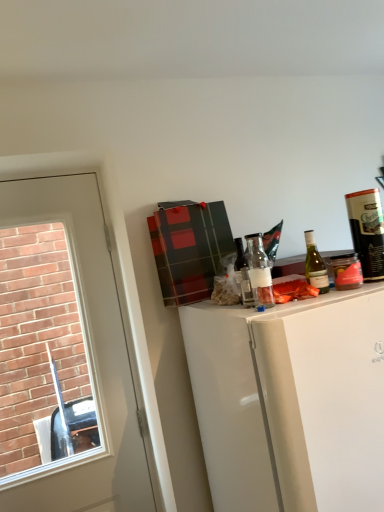
Image resolution: width=384 pixels, height=512 pixels. Describe the element at coordinates (367, 231) in the screenshot. I see `matte black canister at upper right, acting as the first bottle starting from the right` at that location.

You are a GUI agent. You are given a task and a screenshot of the screen. Output one action in this format:
    pyautogui.click(x=<x>, y=<y>)
    Task: Click on the green glass bottle at upper right
    Image resolution: width=384 pixels, height=512 pixels.
    Given the screenshot: What is the action you would take?
    coord(346,271)

Locate an element on the screen. green glass bottle at upper right, the second bottle when ordered from left to right is located at coordinates (315, 265).

What is the approximate width of green glass bottle at upper right, the second bottle when ordered from left to right?

green glass bottle at upper right, the second bottle when ordered from left to right, is 2.02 inches in width.

Locate an element on the screen. The image size is (384, 512). white glossy door at left is located at coordinates (87, 357).

Locate an element on the screen. The height and width of the screenshot is (512, 384). translucent glass bottle at center, which appears as the third bottle when viewed from the right is located at coordinates (243, 274).

Find the location of `matte black canister at upper right, acting as the first bottle starting from the right`. matte black canister at upper right, acting as the first bottle starting from the right is located at coordinates (367, 231).

How different are the orientations of white glossy refrigerator at upper right and white glossy door at left in degrees?

The facing directions of white glossy refrigerator at upper right and white glossy door at left are 0.00301 degrees apart.

Locate an element on the screen. door positioned vertically above the white glossy refrigerator at upper right (from a real-world perspective) is located at coordinates (87, 357).

Which object is positioned more to the right, white glossy refrigerator at upper right or white glossy door at left?

From the viewer's perspective, white glossy refrigerator at upper right appears more on the right side.

From a real-world perspective, is green glass bottle at upper right over green glass bottle at upper right, the second bottle when ordered from left to right?

No, from a real-world perspective, green glass bottle at upper right is not above green glass bottle at upper right, the second bottle when ordered from left to right.

Looking at this image, which of these two, green glass bottle at upper right or green glass bottle at upper right, placed as the 2th bottle when sorted from right to left, is thinner?

With smaller width is green glass bottle at upper right, placed as the 2th bottle when sorted from right to left.

From the image's perspective, which is above, green glass bottle at upper right or green glass bottle at upper right, the second bottle when ordered from left to right?

green glass bottle at upper right, the second bottle when ordered from left to right, appears higher in the image.

Is green glass bottle at upper right positioned beyond the bounds of green glass bottle at upper right, the second bottle when ordered from left to right?

green glass bottle at upper right is positioned outside green glass bottle at upper right, the second bottle when ordered from left to right.

Based on their positions, is green glass bottle at upper right located to the left or right of white glossy door at left?

In the image, green glass bottle at upper right appears on the right side of white glossy door at left.

Which object is wider, green glass bottle at upper right or white glossy door at left?

white glossy door at left is wider.

Considering the positions of objects green glass bottle at upper right and white glossy door at left in the image provided, who is behind, green glass bottle at upper right or white glossy door at left?

white glossy door at left is further away from the camera.

Which of these two, green glass bottle at upper right or white glossy door at left, stands taller?

Standing taller between the two is white glossy door at left.

Can we say white glossy door at left lies outside translucent glass bottle at center, which appears as the third bottle when viewed from the right?

Absolutely, white glossy door at left is external to translucent glass bottle at center, which appears as the third bottle when viewed from the right.

Based on the photo, which object is thinner, white glossy door at left or translucent glass bottle at center, which appears as the third bottle when viewed from the right?

With smaller width is translucent glass bottle at center, which appears as the third bottle when viewed from the right.

Which object is further away from the camera taking this photo, white glossy door at left or translucent glass bottle at center, which appears as the third bottle when viewed from the right?

white glossy door at left is more distant.

Considering the sizes of objects matte black canister at upper right, the 3th bottle when ordered from left to right, and green glass bottle at upper right, the second bottle when ordered from left to right, in the image provided, who is taller, matte black canister at upper right, the 3th bottle when ordered from left to right, or green glass bottle at upper right, the second bottle when ordered from left to right,?

With more height is matte black canister at upper right, the 3th bottle when ordered from left to right.

Is point (368, 217) closer or farther from the camera than point (328, 290)?

Point (368, 217).

Consider the image. Between matte black canister at upper right, the 3th bottle when ordered from left to right, and green glass bottle at upper right, placed as the 2th bottle when sorted from right to left, which one has larger size?

With larger size is matte black canister at upper right, the 3th bottle when ordered from left to right.

Which is more to the left, matte black canister at upper right, the 3th bottle when ordered from left to right, or green glass bottle at upper right, the second bottle when ordered from left to right?

Positioned to the left is green glass bottle at upper right, the second bottle when ordered from left to right.

Consider the image. Between white glossy door at left and green glass bottle at upper right, the second bottle when ordered from left to right, which one has smaller size?

Smaller between the two is green glass bottle at upper right, the second bottle when ordered from left to right.

Between white glossy door at left and green glass bottle at upper right, placed as the 2th bottle when sorted from right to left, which one is positioned in front?

green glass bottle at upper right, placed as the 2th bottle when sorted from right to left, is closer to the camera.

Are white glossy door at left and green glass bottle at upper right, placed as the 2th bottle when sorted from right to left, making contact?

There is a gap between white glossy door at left and green glass bottle at upper right, placed as the 2th bottle when sorted from right to left.

Is green glass bottle at upper right, placed as the 2th bottle when sorted from right to left, surrounded by white glossy door at left?

Definitely not — green glass bottle at upper right, placed as the 2th bottle when sorted from right to left, is not inside white glossy door at left.

Is translucent glass bottle at center, the 1th bottle in the left-to-right sequence, not close to matte black canister at upper right, the 3th bottle when ordered from left to right?

No, there isn't a large distance between translucent glass bottle at center, the 1th bottle in the left-to-right sequence, and matte black canister at upper right, the 3th bottle when ordered from left to right.

Between translucent glass bottle at center, which appears as the third bottle when viewed from the right, and matte black canister at upper right, acting as the first bottle starting from the right, which one has larger width?

matte black canister at upper right, acting as the first bottle starting from the right.

Looking at the image, does translucent glass bottle at center, the 1th bottle in the left-to-right sequence, seem bigger or smaller compared to matte black canister at upper right, the 3th bottle when ordered from left to right?

Clearly, translucent glass bottle at center, the 1th bottle in the left-to-right sequence, is smaller in size than matte black canister at upper right, the 3th bottle when ordered from left to right.

What are the coordinates of `door on the left of white glossy refrigerator at upper right` in the screenshot? It's located at (87, 357).

The image size is (384, 512). In order to click on beverage located on the right of green glass bottle at upper right, the second bottle when ordered from left to right in this screenshot , I will do `click(346, 271)`.

Considering their positions, is matte black canister at upper right, acting as the first bottle starting from the right, positioned closer to white glossy refrigerator at upper right than green glass bottle at upper right?

The object closer to white glossy refrigerator at upper right is green glass bottle at upper right.

Estimate the real-world distances between objects in this image. Which object is closer to green glass bottle at upper right, the second bottle when ordered from left to right, green glass bottle at upper right or white glossy refrigerator at upper right?

green glass bottle at upper right is positioned closer to the anchor green glass bottle at upper right, the second bottle when ordered from left to right.

From the image, which object appears to be farther from green glass bottle at upper right, the second bottle when ordered from left to right, matte black canister at upper right, acting as the first bottle starting from the right, or green glass bottle at upper right?

matte black canister at upper right, acting as the first bottle starting from the right, lies further to green glass bottle at upper right, the second bottle when ordered from left to right, than the other object.

Considering their positions, is green glass bottle at upper right, placed as the 2th bottle when sorted from right to left, positioned closer to green glass bottle at upper right than white glossy door at left?

green glass bottle at upper right, placed as the 2th bottle when sorted from right to left, is positioned closer to the anchor green glass bottle at upper right.

When comparing their distances from white glossy door at left, does green glass bottle at upper right, the second bottle when ordered from left to right, or matte black canister at upper right, acting as the first bottle starting from the right, seem further?

matte black canister at upper right, acting as the first bottle starting from the right.

Looking at this image, looking at the image, which one is located further to green glass bottle at upper right, white glossy door at left or white glossy refrigerator at upper right?

white glossy door at left lies further to green glass bottle at upper right than the other object.

Which object lies further to the anchor point green glass bottle at upper right, white glossy refrigerator at upper right or matte black canister at upper right, the 3th bottle when ordered from left to right?

Based on the image, white glossy refrigerator at upper right appears to be further to green glass bottle at upper right.

Looking at the image, which one is located closer to white glossy door at left, matte black canister at upper right, acting as the first bottle starting from the right, or green glass bottle at upper right?

green glass bottle at upper right.

The height and width of the screenshot is (512, 384). In order to click on beverage that lies between matte black canister at upper right, acting as the first bottle starting from the right, and white glossy refrigerator at upper right from top to bottom in this screenshot , I will do `click(346, 271)`.

Where is `cabinetry located between white glossy door at left and matte black canister at upper right, the 3th bottle when ordered from left to right, in the left-right direction`? This screenshot has height=512, width=384. cabinetry located between white glossy door at left and matte black canister at upper right, the 3th bottle when ordered from left to right, in the left-right direction is located at coordinates (291, 402).

Locate an element on the screen. This screenshot has height=512, width=384. bottle between green glass bottle at upper right, the second bottle when ordered from left to right, and white glossy refrigerator at upper right in the up-down direction is located at coordinates (243, 274).

At what (x,y) coordinates should I click in order to perform the action: click on cabinetry situated between white glossy door at left and green glass bottle at upper right from left to right. Please return your answer as a coordinate pair (x, y). Looking at the image, I should click on (291, 402).